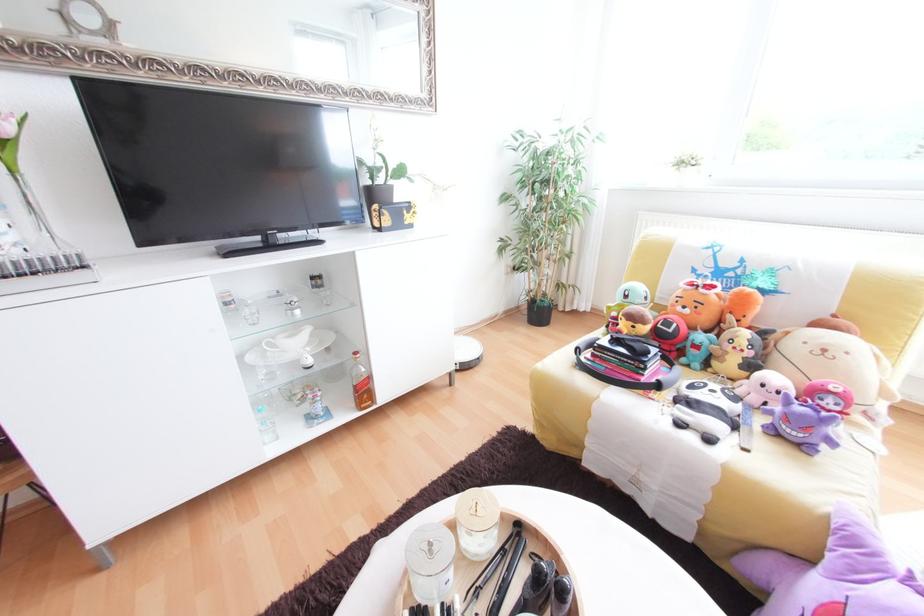
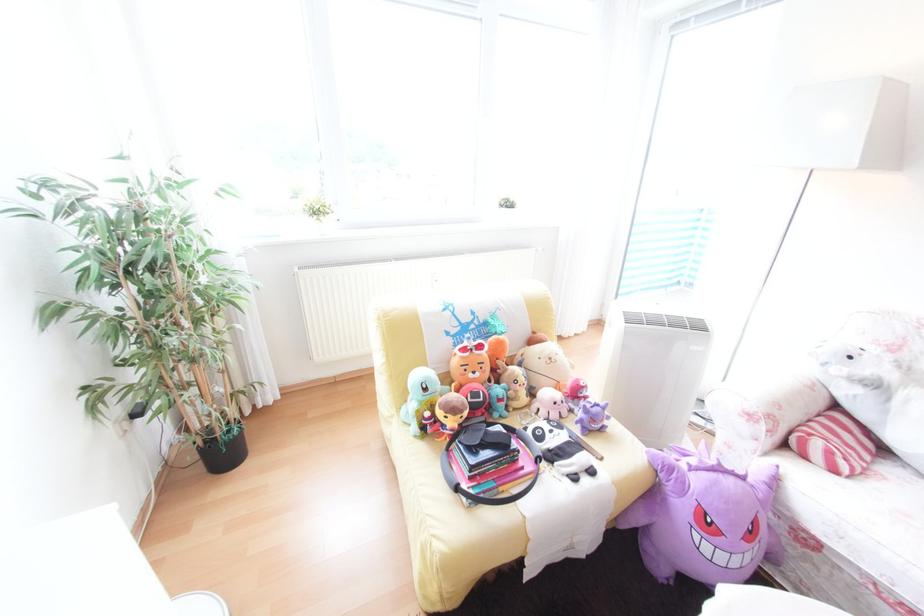
Locate, in the second image, the point that corresponds to point (652, 323) in the first image.

(476, 408)